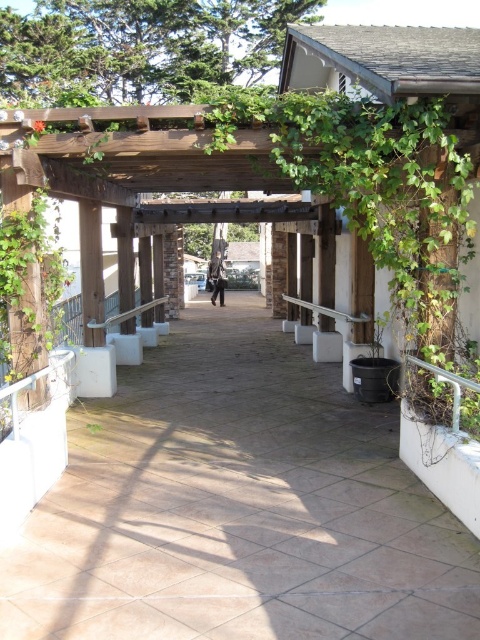
Question: Does brown tile path at center have a larger size compared to silver metallic handrail at center?

Choices:
 (A) yes
 (B) no

Answer: (A)

Question: Which of the following is the closest to the observer?

Choices:
 (A) (321, 307)
 (B) (348, 428)

Answer: (B)

Question: Does brown tile path at center lie behind silver metallic handrail at center?

Choices:
 (A) no
 (B) yes

Answer: (A)

Question: Can you confirm if brown tile path at center is positioned above silver metallic handrail at center?

Choices:
 (A) yes
 (B) no

Answer: (B)